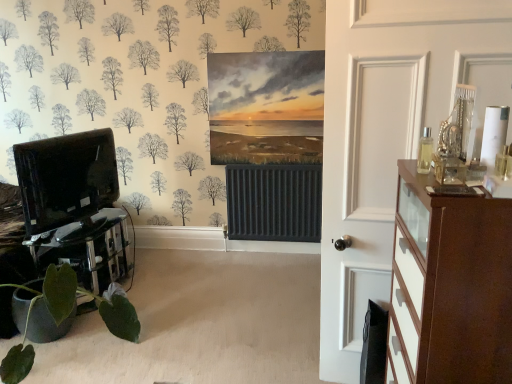
Question: Is brown wood chest of drawers at right taller or shorter than green matte plant at lower left?

Choices:
 (A) short
 (B) tall

Answer: (B)

Question: In terms of size, does brown wood chest of drawers at right appear bigger or smaller than green matte plant at lower left?

Choices:
 (A) big
 (B) small

Answer: (B)

Question: Estimate the real-world distances between objects in this image. Which object is closer to the green matte plant at lower left?

Choices:
 (A) white glossy door at right
 (B) black glass table at lower left
 (C) black glossy entertainment center at left
 (D) brown wood chest of drawers at right

Answer: (B)

Question: Which object is positioned farthest from the brown wood chest of drawers at right?

Choices:
 (A) black glass table at lower left
 (B) white glossy door at right
 (C) black glossy entertainment center at left
 (D) green matte plant at lower left

Answer: (C)